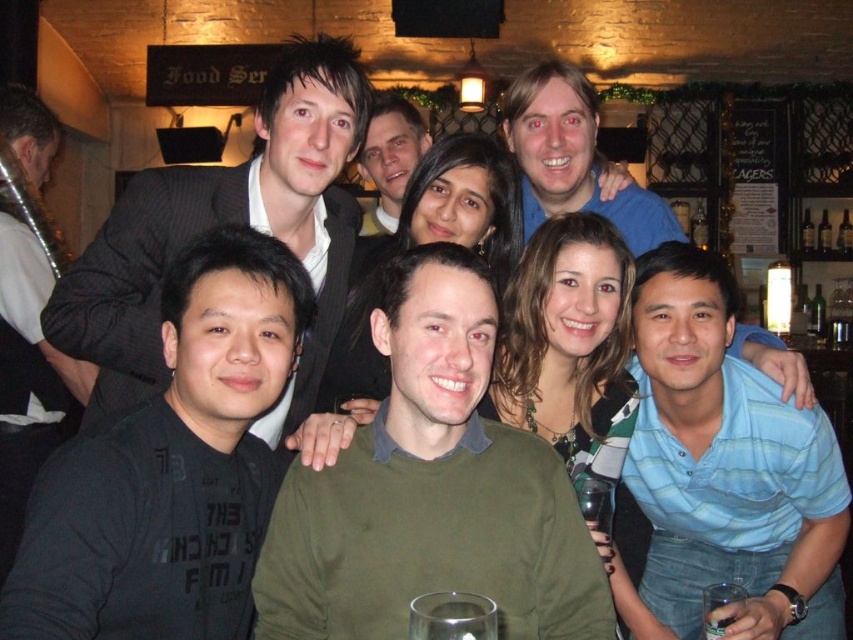
Question: Can you confirm if green matte sweater at center is smaller than black matte suit at upper left?

Choices:
 (A) no
 (B) yes

Answer: (B)

Question: Which of the following is the farthest from the observer?

Choices:
 (A) (573, 92)
 (B) (640, 294)
 (C) (396, 177)
 (D) (82, 298)

Answer: (C)

Question: Which object is positioned closest to the blue striped shirt at lower right?

Choices:
 (A) blue shirt at upper center
 (B) green matte sweater at center
 (C) black matte shirt at lower left

Answer: (B)

Question: Does black matte shirt at lower left have a smaller size compared to blue striped shirt at lower right?

Choices:
 (A) yes
 (B) no

Answer: (A)

Question: Which object is closer to the camera taking this photo?

Choices:
 (A) black matte suit at upper left
 (B) black matte shirt at lower left
 (C) smooth black shirt at center
 (D) blue striped shirt at lower right

Answer: (B)

Question: Does black matte shirt at lower left appear on the right side of smooth black shirt at center?

Choices:
 (A) no
 (B) yes

Answer: (A)